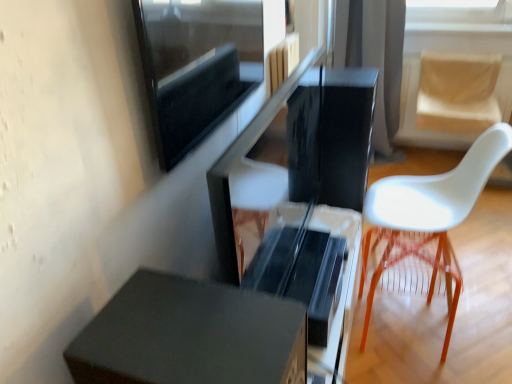
Locate an element on the screen. Image resolution: width=512 pixels, height=384 pixels. vacant area in front of translucent orange stool at right is located at coordinates (418, 372).